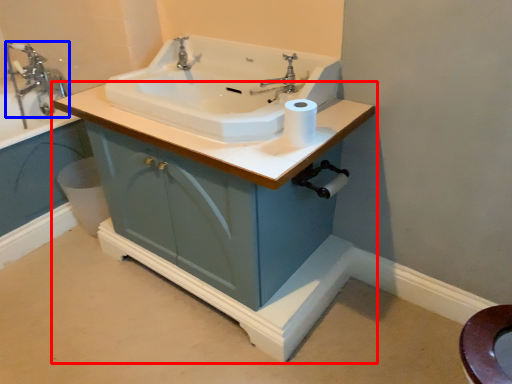
Question: Which object is closer to the camera taking this photo, bathroom cabinet (highlighted by a red box) or tap (highlighted by a blue box)?

Choices:
 (A) bathroom cabinet
 (B) tap

Answer: (A)